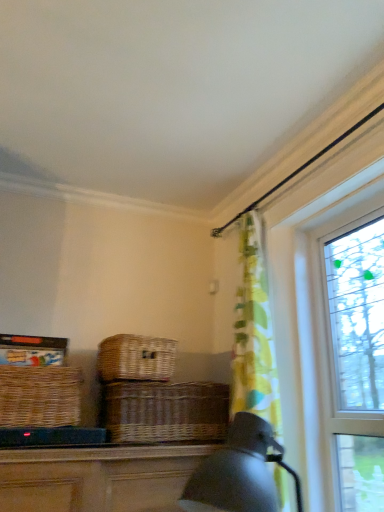
Question: Can you confirm if woven brown picnic basket at left, the 1th picnic basket when ordered from left to right, is wider than clear glass window at right?

Choices:
 (A) no
 (B) yes

Answer: (B)

Question: Is woven brown picnic basket at left, the 1th picnic basket when ordered from left to right, closer to the viewer compared to clear glass window at right?

Choices:
 (A) yes
 (B) no

Answer: (B)

Question: Considering the relative sizes of woven brown picnic basket at left, which ranks as the second picnic basket in right-to-left order, and clear glass window at right in the image provided, is woven brown picnic basket at left, which ranks as the second picnic basket in right-to-left order, shorter than clear glass window at right?

Choices:
 (A) no
 (B) yes

Answer: (B)

Question: From a real-world perspective, is woven brown picnic basket at left, which ranks as the second picnic basket in right-to-left order, over clear glass window at right?

Choices:
 (A) no
 (B) yes

Answer: (A)

Question: Is clear glass window at right to the left or to the right of brown wicker basket at center in the image?

Choices:
 (A) left
 (B) right

Answer: (B)

Question: Considering their positions, is clear glass window at right located in front of or behind brown wicker basket at center?

Choices:
 (A) behind
 (B) front

Answer: (B)

Question: From their relative heights in the image, would you say clear glass window at right is taller or shorter than brown wicker basket at center?

Choices:
 (A) tall
 (B) short

Answer: (A)

Question: From a real-world perspective, relative to brown wicker basket at center, is clear glass window at right vertically above or below?

Choices:
 (A) below
 (B) above

Answer: (B)

Question: Is clear glass window at right bigger or smaller than woven brown picnic basket at left, the 1th picnic basket when ordered from left to right?

Choices:
 (A) small
 (B) big

Answer: (B)

Question: Is clear glass window at right situated inside woven brown picnic basket at left, the 1th picnic basket when ordered from left to right, or outside?

Choices:
 (A) outside
 (B) inside

Answer: (A)

Question: From a real-world perspective, is clear glass window at right positioned above or below woven brown picnic basket at left, the 1th picnic basket when ordered from left to right?

Choices:
 (A) below
 (B) above

Answer: (B)

Question: In terms of height, does clear glass window at right look taller or shorter compared to woven brown picnic basket at left, which ranks as the second picnic basket in right-to-left order?

Choices:
 (A) tall
 (B) short

Answer: (A)

Question: From a real-world perspective, is brown wicker basket at center above or below clear glass window at right?

Choices:
 (A) below
 (B) above

Answer: (A)

Question: Considering the positions of brown wicker basket at center and clear glass window at right in the image, is brown wicker basket at center wider or thinner than clear glass window at right?

Choices:
 (A) thin
 (B) wide

Answer: (B)